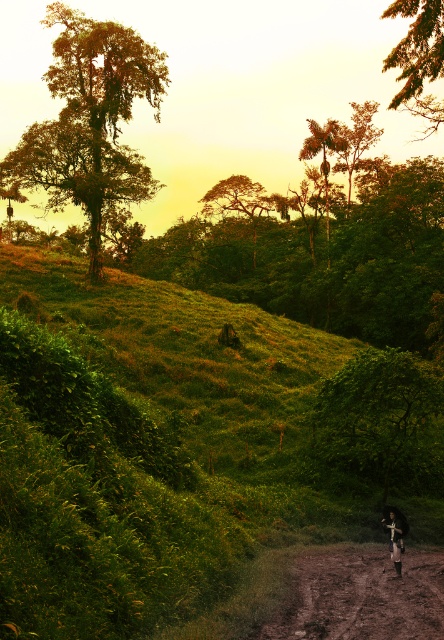
Is green leafy tree at upper left taller than green leafy tree at center?

Indeed, green leafy tree at upper left has a greater height compared to green leafy tree at center.

Who is positioned more to the right, green leafy tree at upper left or green leafy tree at center?

Positioned to the right is green leafy tree at center.

Between point (86, 99) and point (383, 483), which one is positioned in front?

Point (383, 483) is more forward.

Where is `green leafy tree at upper left`? This screenshot has width=444, height=640. green leafy tree at upper left is located at coordinates (91, 120).

In the scene shown: Is green leafy tree at center to the left of brown dirt track at lower right from the viewer's perspective?

In fact, green leafy tree at center is to the right of brown dirt track at lower right.

Image resolution: width=444 pixels, height=640 pixels. In order to click on green leafy tree at center in this screenshot , I will do `click(384, 420)`.

In the scene shown: Between green leafy tree at upper left and dark blue fabric mountain biker at center, which one is positioned lower?

dark blue fabric mountain biker at center is below.

Is green leafy tree at upper left thinner than dark blue fabric mountain biker at center?

No, green leafy tree at upper left is not thinner than dark blue fabric mountain biker at center.

Who is more forward, [88,241] or [388,541]?

Point [388,541]

Find the location of `green leafy tree at upper left`. green leafy tree at upper left is located at coordinates (91, 120).